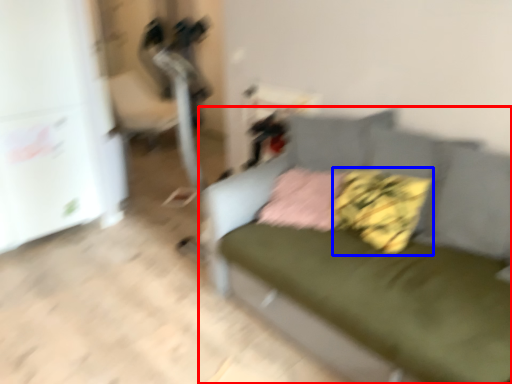
Question: Which point is further to the camera, studio couch (highlighted by a red box) or pillow (highlighted by a blue box)?

Choices:
 (A) studio couch
 (B) pillow

Answer: (B)